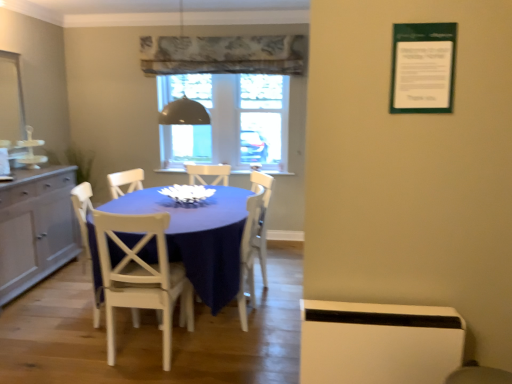
Question: Is white wood chair at center, acting as the 3th chair starting from the front, oriented away from metallic dome at upper center?

Choices:
 (A) yes
 (B) no

Answer: (B)

Question: Considering the relative sizes of white wood chair at center, the 1th chair in the right-to-left sequence, and metallic dome at upper center in the image provided, is white wood chair at center, the 1th chair in the right-to-left sequence, bigger than metallic dome at upper center?

Choices:
 (A) no
 (B) yes

Answer: (B)

Question: Can you confirm if white wood chair at center, acting as the 3th chair starting from the front, is taller than metallic dome at upper center?

Choices:
 (A) no
 (B) yes

Answer: (B)

Question: Does white wood chair at center, acting as the 3th chair starting from the front, have a lesser height compared to metallic dome at upper center?

Choices:
 (A) no
 (B) yes

Answer: (A)

Question: Does white wood chair at center, the 1th chair in the right-to-left sequence, turn towards metallic dome at upper center?

Choices:
 (A) no
 (B) yes

Answer: (A)

Question: Is metallic dome at upper center bigger or smaller than white wood chair at center, the 2th chair in the front-to-back sequence?

Choices:
 (A) big
 (B) small

Answer: (B)

Question: Relative to white wood chair at center, the 2th chair in the front-to-back sequence, is metallic dome at upper center in front or behind?

Choices:
 (A) front
 (B) behind

Answer: (B)

Question: Considering the positions of metallic dome at upper center and white wood chair at center, the 2th chair in the front-to-back sequence, in the image, is metallic dome at upper center wider or thinner than white wood chair at center, the 2th chair in the front-to-back sequence,?

Choices:
 (A) thin
 (B) wide

Answer: (B)

Question: Is point (196, 104) positioned closer to the camera than point (84, 215)?

Choices:
 (A) closer
 (B) farther

Answer: (B)

Question: In the image, is metallic dome at upper center on the left side or the right side of white wood chair at center, the 1th chair in the right-to-left sequence?

Choices:
 (A) left
 (B) right

Answer: (A)

Question: Is metallic dome at upper center inside the boundaries of white wood chair at center, acting as the 3th chair starting from the front, or outside?

Choices:
 (A) inside
 (B) outside

Answer: (B)

Question: Looking at the image, does metallic dome at upper center seem bigger or smaller compared to white wood chair at center, acting as the 3th chair starting from the front?

Choices:
 (A) big
 (B) small

Answer: (B)

Question: From a real-world perspective, is metallic dome at upper center physically located above or below white wood chair at center, which ranks as the first chair in back-to-front order?

Choices:
 (A) above
 (B) below

Answer: (A)

Question: Is black glass dome at center, which appears as the second window screen when viewed from the right, taller or shorter than transparent glass window at center, positioned as the second window screen in left-to-right order?

Choices:
 (A) tall
 (B) short

Answer: (A)

Question: From a real-world perspective, is black glass dome at center, which appears as the second window screen when viewed from the right, positioned above or below transparent glass window at center, marked as the 1th window screen in a right-to-left arrangement?

Choices:
 (A) above
 (B) below

Answer: (A)